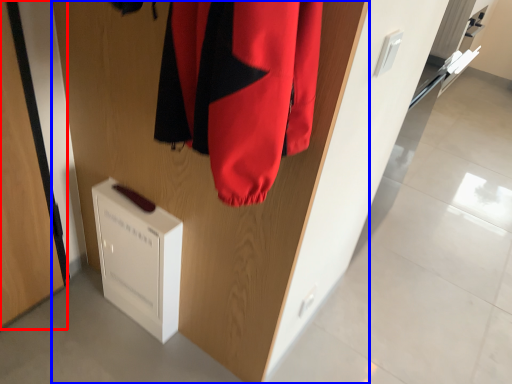
Question: Which point is closer to the camera, door (highlighted by a red box) or door (highlighted by a blue box)?

Choices:
 (A) door
 (B) door

Answer: (B)